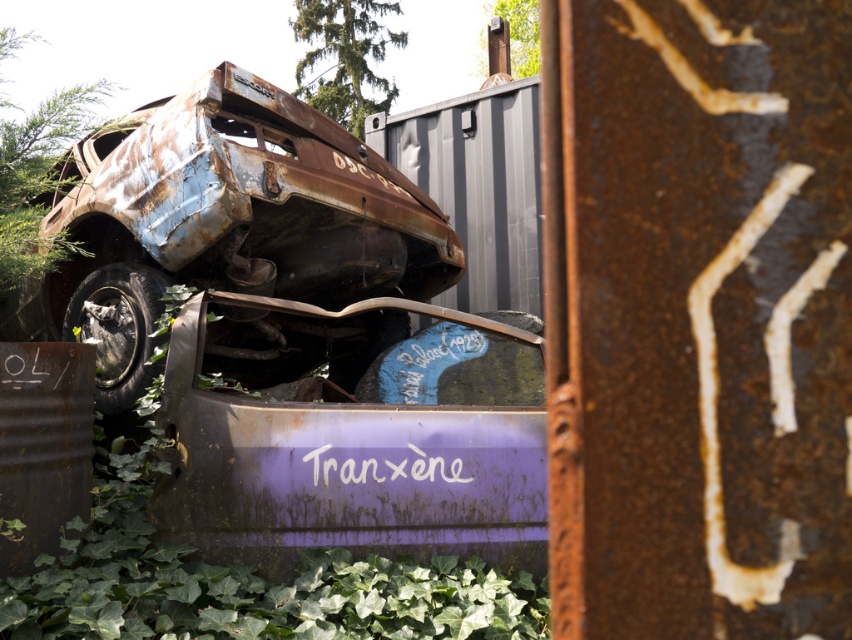
Question: Does rusty metal car at center appear on the right side of green leafy vegetation at upper center?

Choices:
 (A) no
 (B) yes

Answer: (B)

Question: Among these points, which one is farthest from the camera?

Choices:
 (A) (104, 413)
 (B) (112, 310)
 (C) (441, 420)

Answer: (B)

Question: Based on their relative distances, which object is nearer to the rusty metal car at center?

Choices:
 (A) purple matte car at center
 (B) rusty metal tire at lower left
 (C) green leafy vegetation at upper center

Answer: (B)

Question: Is purple matte car at center thinner than green leafy vegetation at upper center?

Choices:
 (A) yes
 (B) no

Answer: (A)

Question: Which of these objects is positioned farthest from the purple matte car at center?

Choices:
 (A) rusty metal tire at lower left
 (B) green leafy vegetation at upper center
 (C) rusty metal car at center

Answer: (B)

Question: Is rusty metal car at center to the right of purple matte car at center from the viewer's perspective?

Choices:
 (A) no
 (B) yes

Answer: (A)